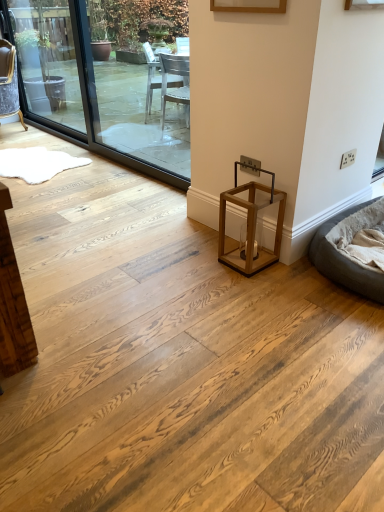
Question: From the image's perspective, is transparent glass window at upper left, arranged as the second window screen when viewed from the right, positioned above or below gray fabric bean bag at lower right?

Choices:
 (A) above
 (B) below

Answer: (A)

Question: In terms of height, does transparent glass window at upper left, the first window screen positioned from the left, look taller or shorter compared to gray fabric bean bag at lower right?

Choices:
 (A) tall
 (B) short

Answer: (A)

Question: Which is nearer to the transparent glass window at upper left, the first window screen positioned from the left?

Choices:
 (A) transparent glass window at left, which appears as the 1th window screen when viewed from the right
 (B) gray fabric bean bag at lower right
 (C) velvet grey chair at left

Answer: (C)

Question: Considering the real-world distances, which object is farthest from the velvet grey chair at left?

Choices:
 (A) gray fabric bean bag at lower right
 (B) transparent glass window at left, which appears as the 1th window screen when viewed from the right
 (C) transparent glass window at upper left, the first window screen positioned from the left

Answer: (A)